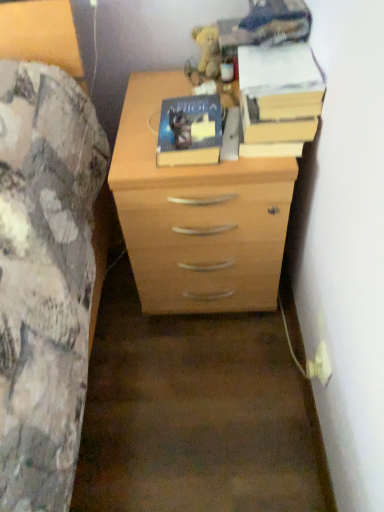
Where is `vacant area on top of light wood chest of drawers at center (from a real-world perspective)`? The height and width of the screenshot is (512, 384). vacant area on top of light wood chest of drawers at center (from a real-world perspective) is located at coordinates (188, 96).